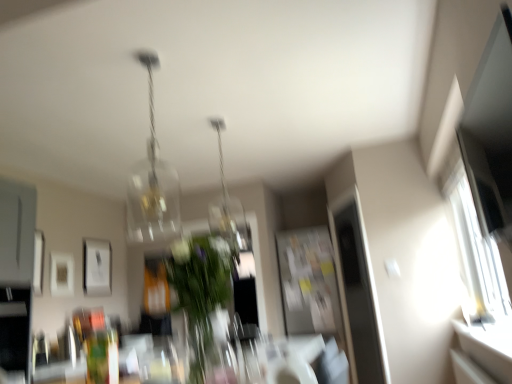
In order to click on blank space above clear glass pendant light at center, placed as the first lamp when sorted from right to left (from a real-world perspective) in this screenshot , I will do `click(214, 122)`.